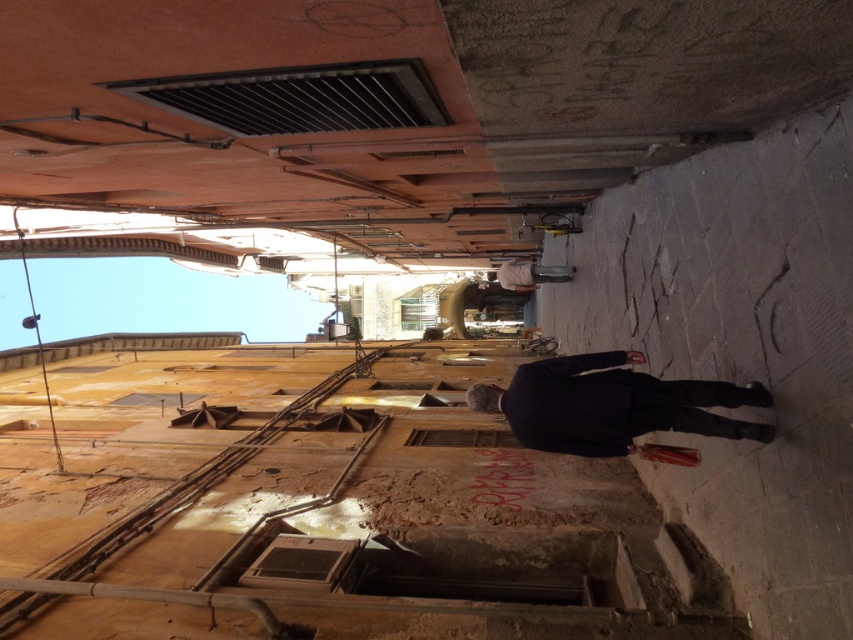
You are a delivery person carrying a box that is 1.5 meters long. You need to walk from the rustic stone steps at lower right to the dark blue suit at center. Is there enough space between them for you and your box?

The distance between the rustic stone steps at lower right and the dark blue suit at center is 3.29 meters. Since your box is 1.5 meters long, there is sufficient space as 3.29 meters is greater than 1.5 meters.

Looking at this image, you are standing at the entrance of the alley and see the rustic stone steps at lower right and the dark blue suit at center. Which object is closer to you?

The rustic stone steps at lower right are closer to you than the dark blue suit at center because they are positioned under it.

You are a delivery person carrying a large box that is 1.2 meters wide. You are standing at the entrance of the alley and see the rustic stone steps at lower right and the dark blue suit at center. Can you pass through the space between them with your box?

The rustic stone steps at lower right might be wider than dark blue suit at center, so the space between them could accommodate your 1.2 meter wide box. However, since the exact width isn